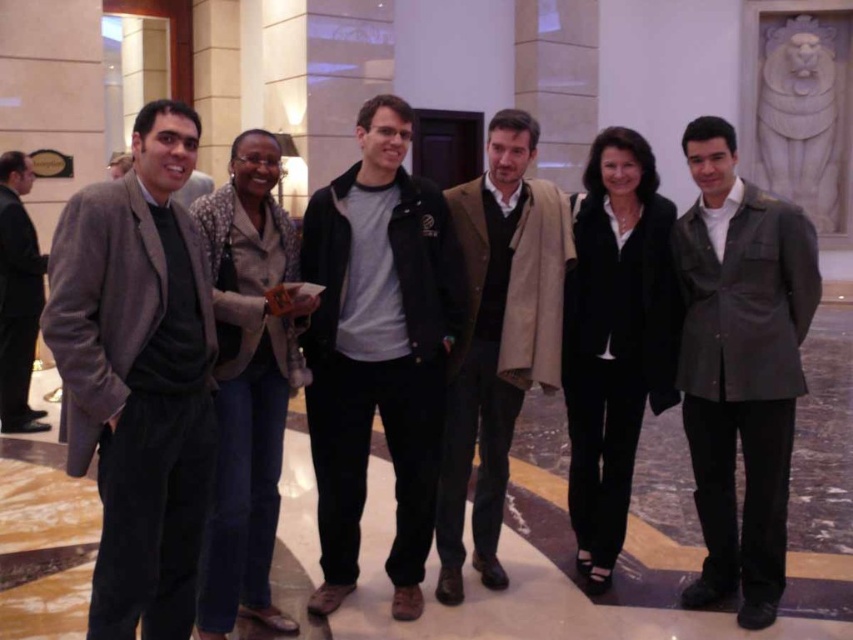
Which is more to the right, dark gray leather jacket at right or brown woolen scarf at center?

dark gray leather jacket at right

Can you confirm if dark gray leather jacket at right is wider than brown woolen scarf at center?

In fact, dark gray leather jacket at right might be narrower than brown woolen scarf at center.

Who is more forward, (x=698, y=150) or (x=515, y=285)?

Point (x=698, y=150) is in front.

Image resolution: width=853 pixels, height=640 pixels. I want to click on dark gray leather jacket at right, so click(740, 365).

Does black matte jacket at center have a lesser width compared to dark gray leather jacket at right?

No.

Is black matte jacket at center to the right of dark gray leather jacket at right from the viewer's perspective?

Incorrect, black matte jacket at center is not on the right side of dark gray leather jacket at right.

Find the location of a particular element. black matte jacket at center is located at coordinates (378, 349).

Who is more forward, (154,180) or (392,369)?

Positioned in front is point (154,180).

Is gray woolen blazer at left bigger than black matte jacket at center?

Incorrect, gray woolen blazer at left is not larger than black matte jacket at center.

The width and height of the screenshot is (853, 640). I want to click on gray woolen blazer at left, so click(137, 376).

This screenshot has height=640, width=853. Identify the location of gray woolen blazer at left. (137, 376).